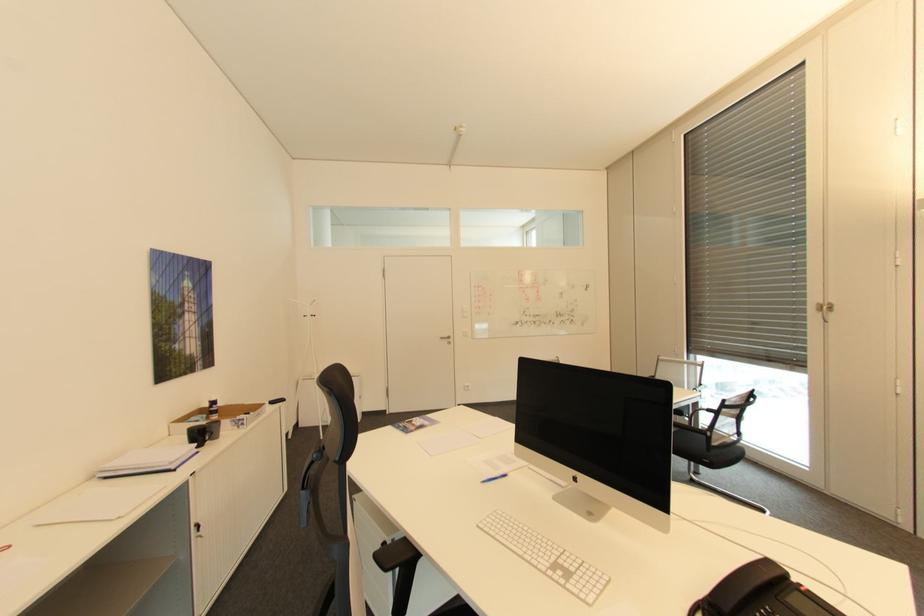
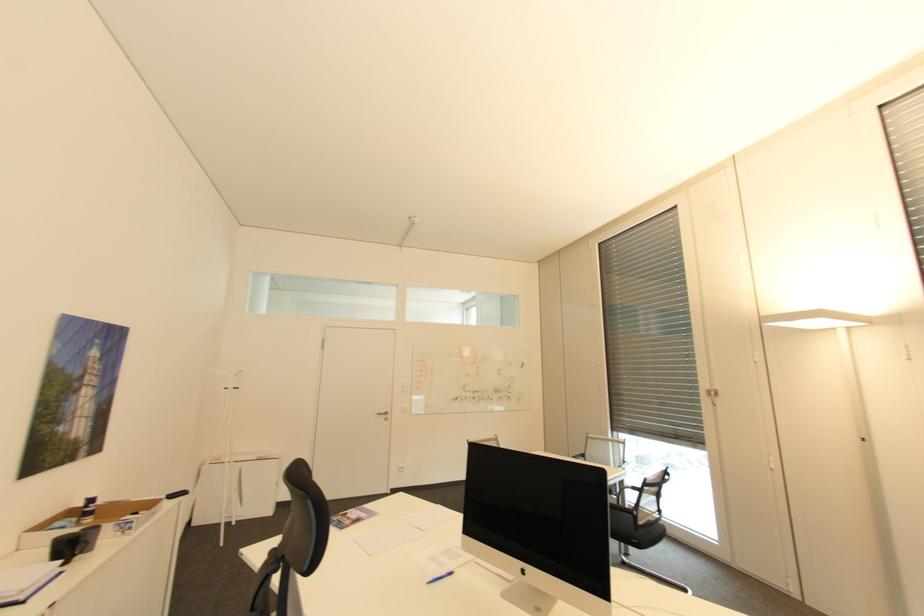
Locate, in the second image, the point that corresponds to (x=719, y=443) in the first image.

(646, 523)